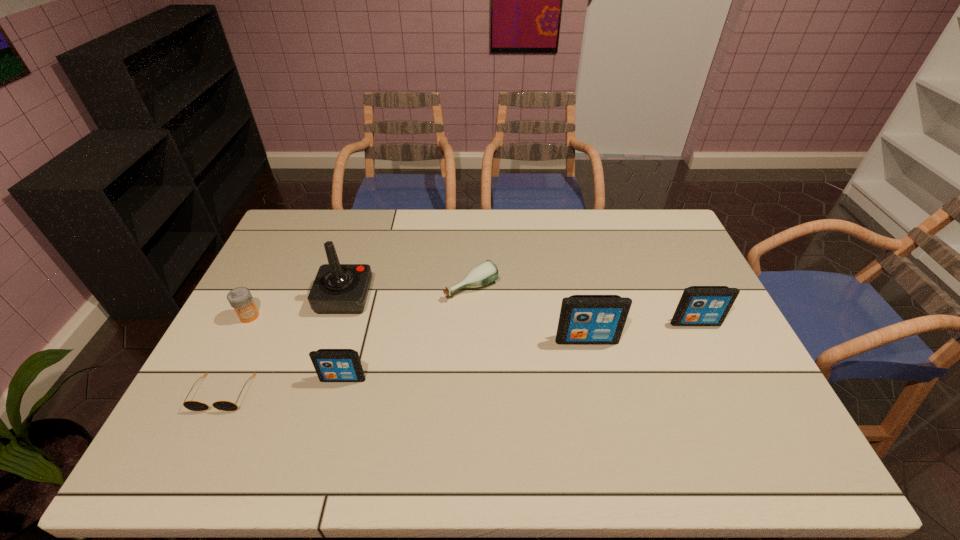
Identify the location of the fourth tallest object. (331, 365).

Where is `the shortest iPod`? This screenshot has width=960, height=540. the shortest iPod is located at coordinates (331, 365).

I want to click on the tallest iPod, so click(584, 319).

Find the location of a particular element. Image resolution: width=960 pixels, height=540 pixels. the second tallest object is located at coordinates (584, 319).

Find the location of `the second tallest iPod`. the second tallest iPod is located at coordinates (699, 305).

Identify the location of the farthest iPod. tap(699, 305).

In order to click on the fifth tallest object in this screenshot , I will do `click(240, 298)`.

This screenshot has height=540, width=960. Find the location of `the tallest object`. the tallest object is located at coordinates (338, 288).

The height and width of the screenshot is (540, 960). Identify the location of the second shortest object. (486, 272).

What are the coordinates of `bottle` in the screenshot? It's located at (486, 272).